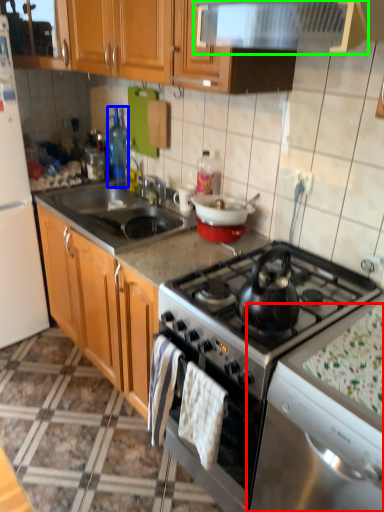
Question: Considering the real-world distances, which object is farthest from silver (highlighted by a red box)? bottle (highlighted by a blue box) or exhaust hood (highlighted by a green box)?

Choices:
 (A) bottle
 (B) exhaust hood

Answer: (A)